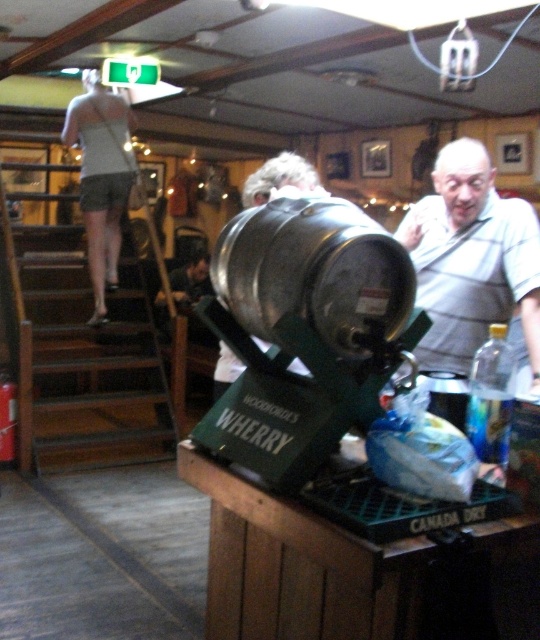
Does shiny silver barrel at center appear on the left side of gray striped shirt at upper right?

Correct, you'll find shiny silver barrel at center to the left of gray striped shirt at upper right.

Locate an element on the screen. The height and width of the screenshot is (640, 540). shiny silver barrel at center is located at coordinates (313, 269).

Who is positioned more to the right, gray striped shirt at upper right or light gray fabric shorts at upper left?

gray striped shirt at upper right

Locate an element on the screen. The image size is (540, 640). gray striped shirt at upper right is located at coordinates (471, 260).

Describe the element at coordinates (471, 260) in the screenshot. This screenshot has width=540, height=640. I see `gray striped shirt at upper right` at that location.

The height and width of the screenshot is (640, 540). In order to click on gray striped shirt at upper right in this screenshot , I will do `click(471, 260)`.

Does shiny silver barrel at center have a greater height compared to light gray fabric shorts at upper left?

Incorrect, shiny silver barrel at center's height is not larger of light gray fabric shorts at upper left's.

Does point (284, 256) come behind point (84, 124)?

No.

The height and width of the screenshot is (640, 540). Identify the location of shiny silver barrel at center. (313, 269).